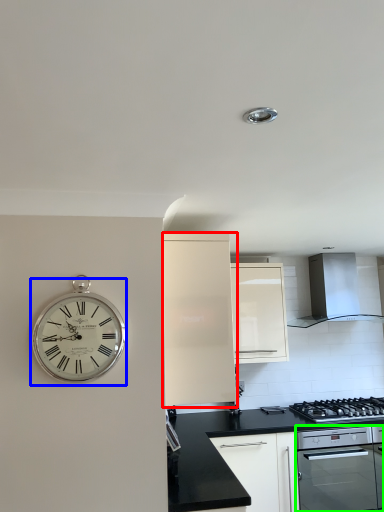
Question: Which object is positioned closest to cabinetry (highlighted by a red box)? Select from wall clock (highlighted by a blue box) and oven (highlighted by a green box).

Choices:
 (A) wall clock
 (B) oven

Answer: (A)